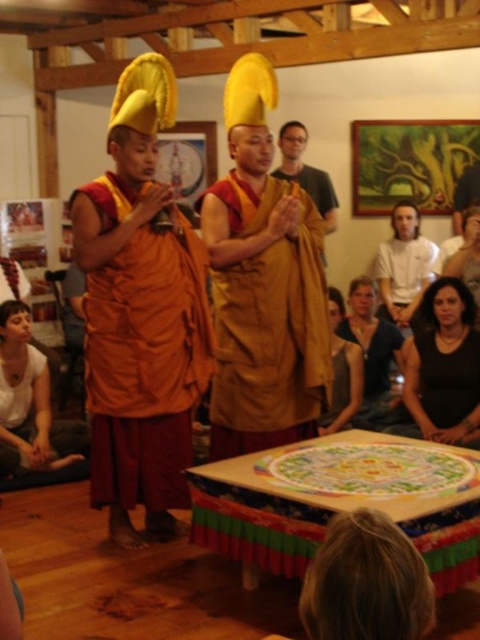
You are an observer in the community hall. You notice the orange clothed monk at left and the matte gold robe at center. Which of these two objects is larger in size?

The orange clothed monk at left is bigger than the matte gold robe at center.

You are a photographer standing in the middle of the hall. You want to take a photo that includes both the orange clothed monk at left and the smooth brown leather jacket at lower right. Can you fit both subjects into the frame of your camera which has a maximum field of view of 4 meters? Explain your reasoning.

The orange clothed monk at left and the smooth brown leather jacket at lower right are 3.74 meters apart from each other. Since the distance between them is less than the camera field of view of 4 meters, both subjects can be captured in the same frame.

Where is the orange clothed monk at left located in the scene?

The orange clothed monk at left is located at point (141,314).